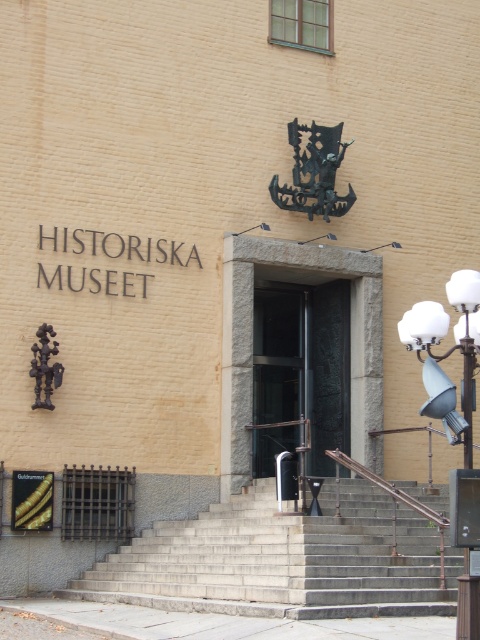
In the scene shown: You are a visitor at the entrance of the Swedish History Museum. You see the gray concrete stairs at center and the goldmetallicsign at lower left. Which object is bigger in size?

The gray concrete stairs at center is larger in size than the goldmetallicsign at lower left.

You are standing at the entrance of the Swedish History Museum. You need to determine which object is shorter between the transparent glass door at center and the goldmetallicsign at lower left. Based on the scene, which one is shorter?

The transparent glass door at center is shorter than the goldmetallicsign at lower left according to the description.